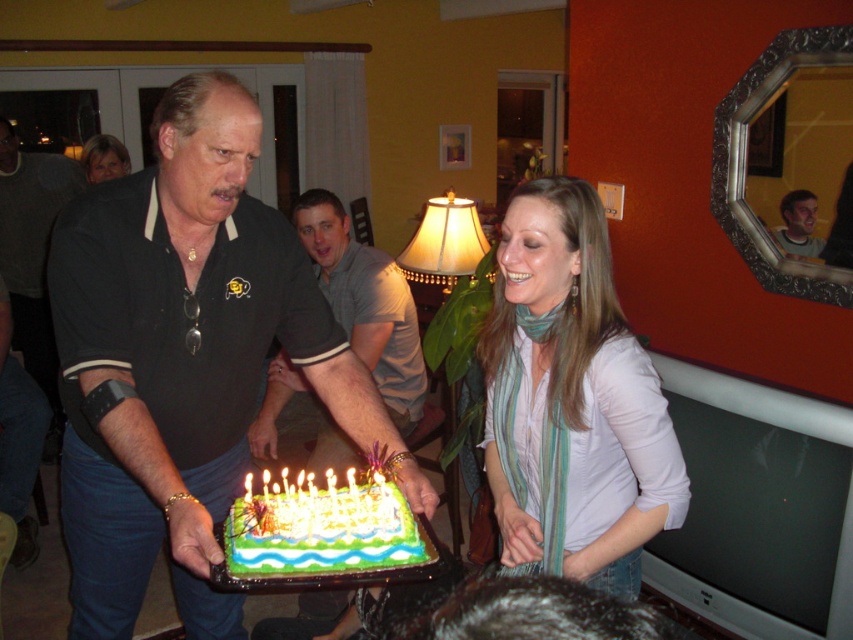
You are at a birthday party and see the gray cotton polo shirt at center and the blonde hair at upper left. Which one is closer to you?

The gray cotton polo shirt at center is closer to you because it is in front of the blonde hair at upper left.

You are a photographer at the celebration and want to capture a photo where both the gray cotton polo shirt at center and the blonde hair at upper left are visible. Based on their heights, which one is more likely to be fully visible in the shot?

The gray cotton polo shirt at center has a greater height compared to blonde hair at upper left, so it is more likely to be fully visible in the photo.

You are a photographer at this birthday celebration. You need to take a photo of the matte black shirt at center and the light brown hair at upper right. Which one should you focus on first to ensure both are in focus?

You should focus on the matte black shirt at center first because it is closer to the viewer than the light brown hair at upper right, so adjusting focus from near to far will help both be in focus.